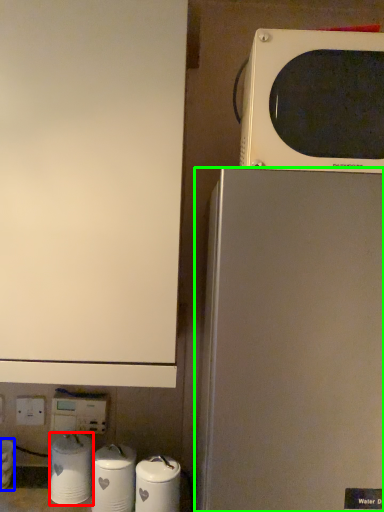
Question: Estimate the real-world distances between objects in this image. Which object is farther from appliance (highlighted by a red box), appliance (highlighted by a blue box) or refrigerator (highlighted by a green box)?

Choices:
 (A) appliance
 (B) refrigerator

Answer: (B)